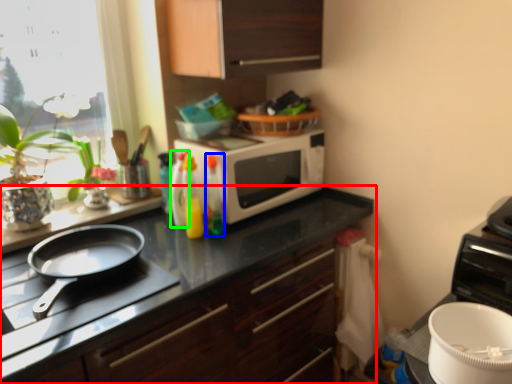
Question: Which object is the farthest from cabinetry (highlighted by a red box)? Choose among these: bottle (highlighted by a blue box) or bottle (highlighted by a green box).

Choices:
 (A) bottle
 (B) bottle

Answer: (B)